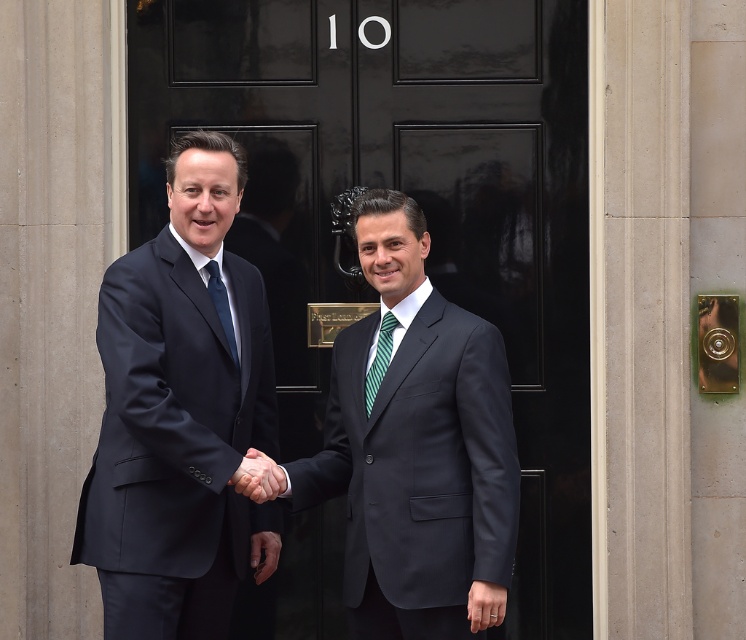
Who is positioned more to the right, black glossy door at center or dark blue suit at center?

From the viewer's perspective, black glossy door at center appears more on the right side.

Does black glossy door at center appear over dark blue suit at center?

Indeed, black glossy door at center is positioned over dark blue suit at center.

Locate an element on the screen. The image size is (746, 640). black glossy door at center is located at coordinates (410, 195).

The width and height of the screenshot is (746, 640). I want to click on black glossy door at center, so click(x=410, y=195).

Can you confirm if black glossy door at center is positioned to the right of green striped tie at center?

Indeed, black glossy door at center is positioned on the right side of green striped tie at center.

Measure the distance between black glossy door at center and camera.

black glossy door at center and camera are 23.30 feet apart from each other.

Locate an element on the screen. This screenshot has height=640, width=746. black glossy door at center is located at coordinates coord(410,195).

Which is more to the right, dark blue suit at center or matte black tie at center?

Positioned to the right is dark blue suit at center.

Is point (357, 564) closer to camera compared to point (231, 337)?

Yes.

Is point (313, 474) positioned before point (219, 305)?

That is False.

You are a GUI agent. You are given a task and a screenshot of the screen. Output one action in this format:
    pyautogui.click(x=<x>, y=<y>)
    Task: Click on the dark blue suit at center
    
    Given the screenshot: What is the action you would take?
    pyautogui.click(x=416, y=449)